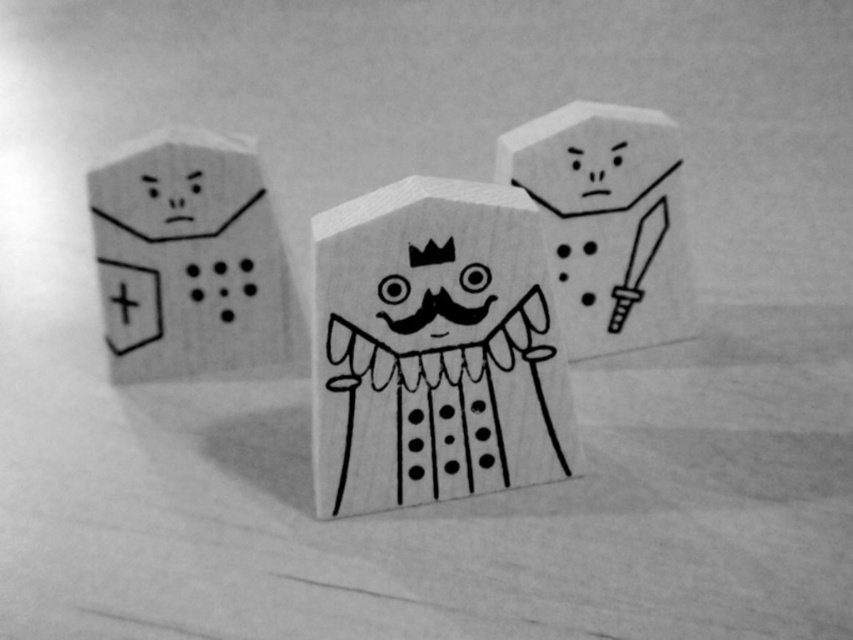
Does wooden king at center lie in front of wooden block at left?

Yes.

How much distance is there between wooden king at center and wooden block at left?

A distance of 26.24 centimeters exists between wooden king at center and wooden block at left.

Image resolution: width=853 pixels, height=640 pixels. Describe the element at coordinates (434, 349) in the screenshot. I see `wooden king at center` at that location.

Locate an element on the screen. wooden king at center is located at coordinates (434, 349).

Who is positioned more to the left, wooden king at center or wooden block at center?

wooden king at center is more to the left.

From the picture: Is wooden king at center to the left of wooden block at center from the viewer's perspective?

Yes, wooden king at center is to the left of wooden block at center.

Where is `wooden king at center`? The height and width of the screenshot is (640, 853). wooden king at center is located at coordinates (434, 349).

At what (x,y) coordinates should I click in order to perform the action: click on wooden king at center. Please return your answer as a coordinate pair (x, y). Looking at the image, I should click on (434, 349).

Does wooden block at left have a larger size compared to wooden block at center?

Correct, wooden block at left is larger in size than wooden block at center.

Between wooden block at left and wooden block at center, which one is positioned lower?

wooden block at left is below.

Is point (106, 344) positioned behind point (547, 192)?

Yes, point (106, 344) is farther from viewer.

The width and height of the screenshot is (853, 640). Identify the location of wooden block at left. (190, 260).